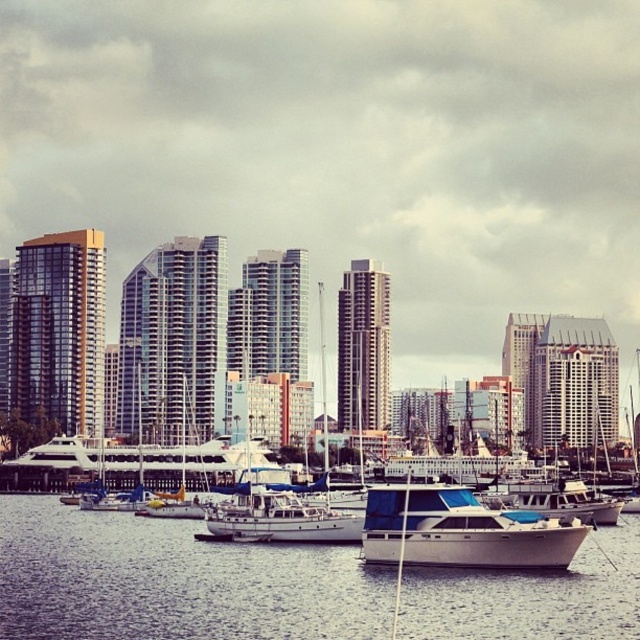
Is white matte water at center to the left of white glossy sailboat at center from the viewer's perspective?

In fact, white matte water at center is to the right of white glossy sailboat at center.

In the scene shown: Is white matte water at center to the right of white glossy sailboat at center from the viewer's perspective?

Yes, white matte water at center is to the right of white glossy sailboat at center.

Does point (214, 598) come behind point (204, 513)?

No, it is not.

Find the location of a particular element. white matte water at center is located at coordinates (173, 580).

Who is lower down, white glossy boat at center or white glossy sailboat at center?

white glossy sailboat at center

Can you confirm if white glossy boat at center is wider than white glossy sailboat at center?

Yes.

Who is more forward, (449, 484) or (184, 476)?

Point (184, 476) is in front.

In order to click on white glossy boat at center in this screenshot , I will do 461,531.

Between white matte water at center and white glossy boat at center, which one has less height?

white glossy boat at center

Which is more to the left, white matte water at center or white glossy boat at center?

From the viewer's perspective, white matte water at center appears more on the left side.

Describe the element at coordinates (173, 580) in the screenshot. This screenshot has width=640, height=640. I see `white matte water at center` at that location.

The image size is (640, 640). Identify the location of white matte water at center. (173, 580).